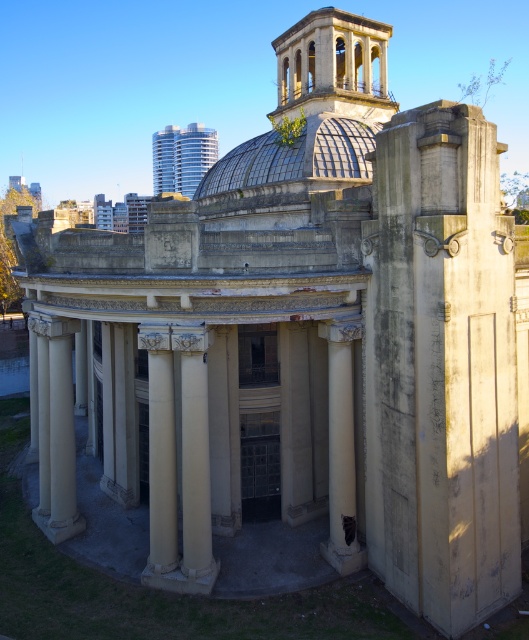
You are an architect examining the historical building. You notice the beige stone column at right and the white stone column at center. Which column is positioned higher in the structure?

The beige stone column at right is above the white stone column at center, so it is positioned higher in the structure.

You are an architect examining the historical building. You notice the matte glass dome at upper center and the white stone column at center. From your vantage point, which of these two elements is positioned to the left?

The matte glass dome at upper center is positioned to the left of the white stone column at center.